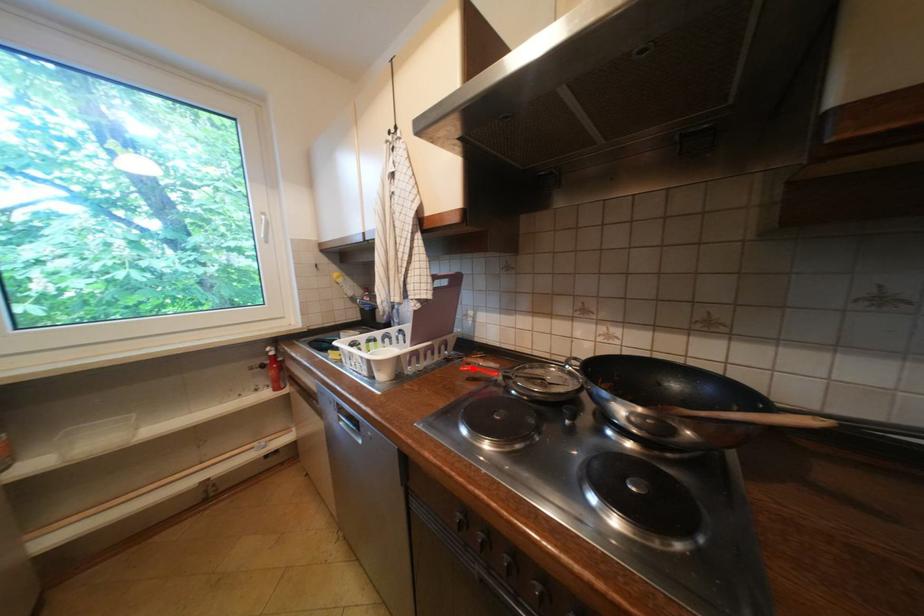
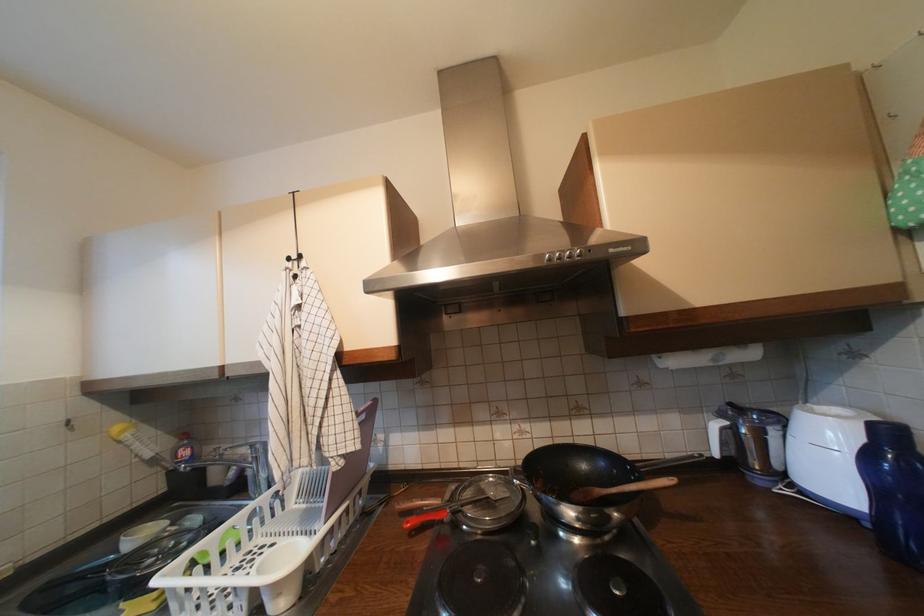
Where in the second image is the point corresponding to the highlighted location from the first image?

(417, 524)